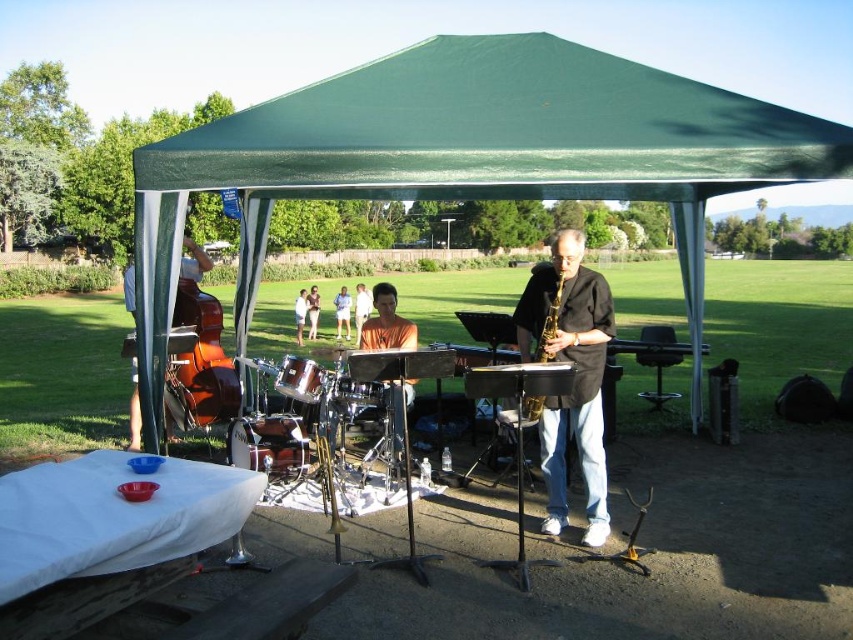
You are a photographer trying to capture a clear shot of the gold shiny saxophone at center. However, the green fabric canopy at upper center is blocking your view. Based on the scene description, can you adjust your position to get an unobstructed view of the saxophone?

The green fabric canopy at upper center is in front of the gold shiny saxophone at center, so moving your position to the side or adjusting the angle might allow you to see around the canopy and capture the saxophone without obstruction.

In the scene of the outdoor band performance under the green canopy tent, you notice a double bass on the left, a drum set at center, and a saxophonist on the right. There is also a point marked at coordinates (361, 308). What object is located at that specific coordinate?

The point at coordinates (361, 308) marks the location of the smooth brown leather jacket at center.

Based on the photo, you are a photographer trying to capture the saxophonist under the green canopy. Since the green fabric canopy at upper center and gold shiny saxophone at center are both in the frame, which object is located to the left of the other?

The green fabric canopy at upper center is positioned on the left side of gold shiny saxophone at center.